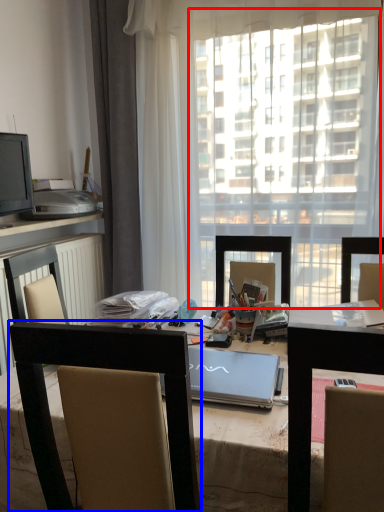
Question: Among these objects, which one is farthest to the camera, window screen (highlighted by a red box) or chair (highlighted by a blue box)?

Choices:
 (A) window screen
 (B) chair

Answer: (A)